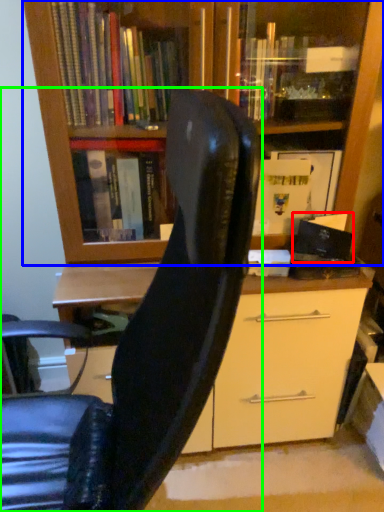
Question: Which is farther away from paperback book (highlighted by a red box)? bookcase (highlighted by a blue box) or chair (highlighted by a green box)?

Choices:
 (A) bookcase
 (B) chair

Answer: (B)